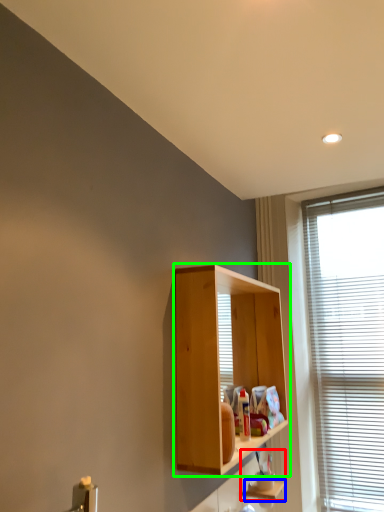
Question: Which object is positioned farthest from cabinet (highlighted by a red box)? Select from shelf (highlighted by a blue box) and cabinetry (highlighted by a green box).

Choices:
 (A) shelf
 (B) cabinetry

Answer: (B)